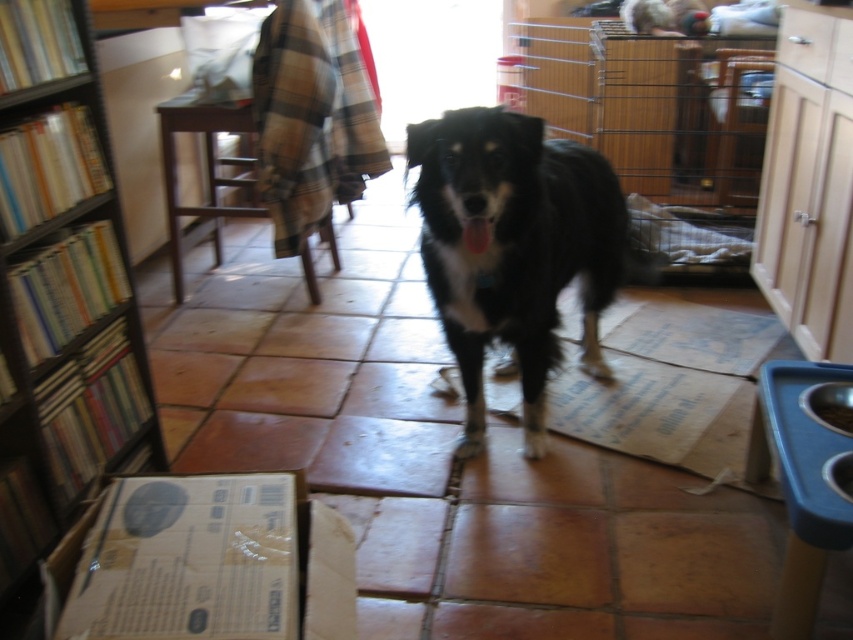
Which is in front, point (20, 381) or point (616, 193)?

Point (20, 381)

Is point (68, 236) more distant than point (490, 269)?

No, (68, 236) is closer to viewer.

The image size is (853, 640). Identify the location of brown wooden bookcase at left. (61, 291).

Who is positioned more to the left, brown wooden bookcase at left or brown cardboard box at lower left?

brown wooden bookcase at left

Does brown wooden bookcase at left have a larger size compared to brown cardboard box at lower left?

Correct, brown wooden bookcase at left is larger in size than brown cardboard box at lower left.

Describe the element at coordinates (61, 291) in the screenshot. I see `brown wooden bookcase at left` at that location.

At what (x,y) coordinates should I click in order to perform the action: click on brown wooden bookcase at left. Please return your answer as a coordinate pair (x, y). The height and width of the screenshot is (640, 853). Looking at the image, I should click on (61, 291).

Who is shorter, black fur dog at center or brown cardboard box at lower left?

With less height is brown cardboard box at lower left.

Between point (482, 256) and point (170, 540), which one is positioned behind?

Point (482, 256)

Is point (482, 364) closer to viewer compared to point (172, 561)?

No, (482, 364) is behind (172, 561).

Locate an element on the screen. black fur dog at center is located at coordinates (514, 250).